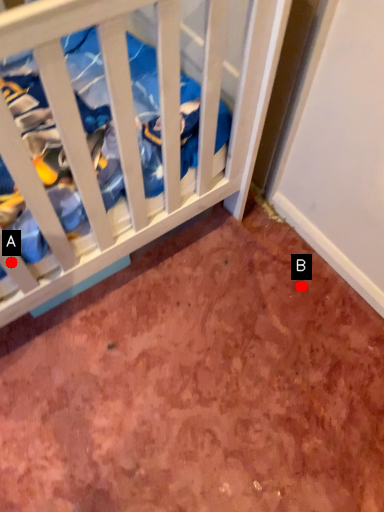
Question: Two points are circled on the image, labeled by A and B beside each circle. Which point is further to the camera?

Choices:
 (A) A is further
 (B) B is further

Answer: (B)